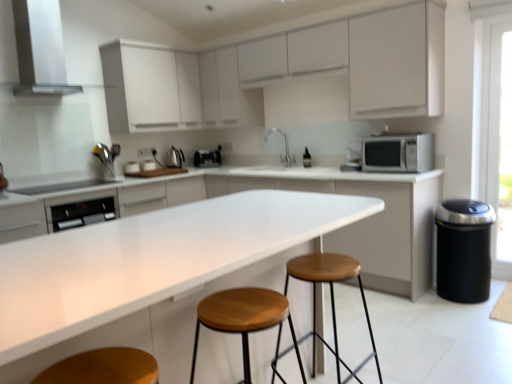
Locate an element on the screen. vacant space situated above white glossy countertop at center (from a real-world perspective) is located at coordinates (184, 228).